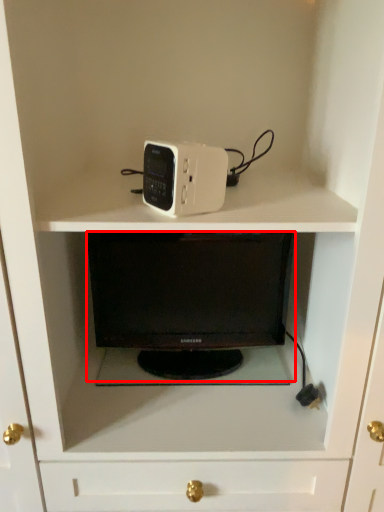
Question: From the image's perspective, where is desktop (annotated by the red box) located in relation to home appliance in the image?

Choices:
 (A) below
 (B) above

Answer: (A)